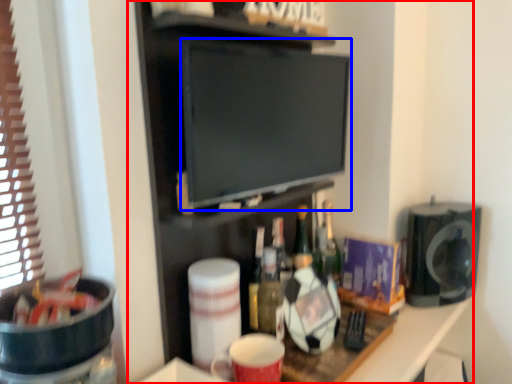
Question: Among these objects, which one is farthest to the camera, entertainment center (highlighted by a red box) or flat (highlighted by a blue box)?

Choices:
 (A) entertainment center
 (B) flat

Answer: (B)